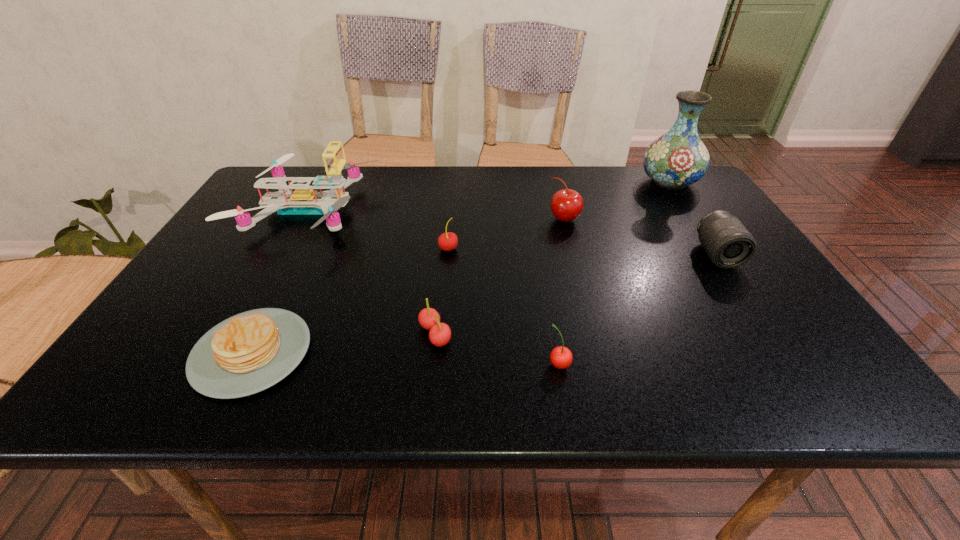
At what (x,y) coordinates should I click in order to perform the action: click on vase. Please return your answer as a coordinate pair (x, y). Image resolution: width=960 pixels, height=540 pixels. Looking at the image, I should click on tap(678, 158).

Image resolution: width=960 pixels, height=540 pixels. Identify the location of drone. (304, 200).

The height and width of the screenshot is (540, 960). I want to click on the rightmost cherry, so click(566, 205).

The image size is (960, 540). Identify the location of the farthest cherry. (566, 205).

At what (x,y) coordinates should I click in order to perform the action: click on telephoto lens. Please return your answer as a coordinate pair (x, y). The image size is (960, 540). Looking at the image, I should click on (727, 242).

Locate an element on the screen. the second farthest cherry is located at coordinates (448, 241).

Find the location of `the nearest cherry`. the nearest cherry is located at coordinates (561, 357).

Where is `the third cherry from left to right`? This screenshot has width=960, height=540. the third cherry from left to right is located at coordinates (561, 357).

At what (x,y) coordinates should I click in order to perform the action: click on the third farthest cherry. Please return your answer as a coordinate pair (x, y). Looking at the image, I should click on (440, 333).

The width and height of the screenshot is (960, 540). I want to click on the shortest object, so click(247, 353).